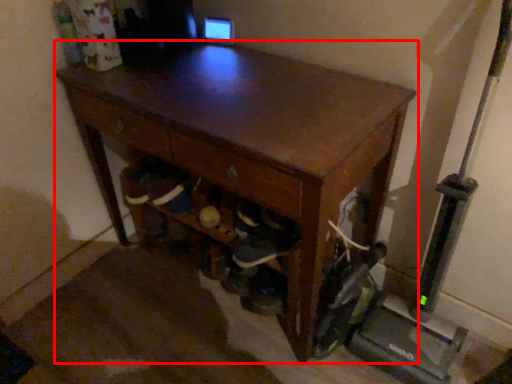
Question: From the image, what is the correct spatial relationship of desk (annotated by the red box) in relation to drawer?

Choices:
 (A) left
 (B) right

Answer: (B)